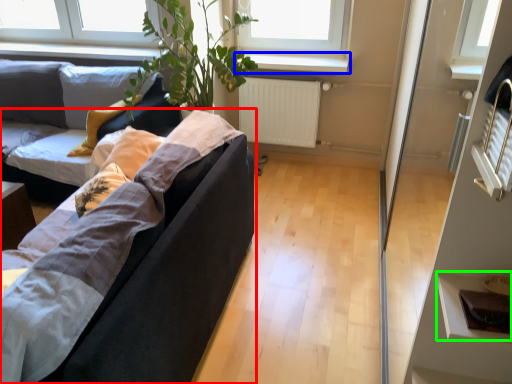
Question: Which object is positioned farthest from studio couch (highlighted by a red box)? Select from window sill (highlighted by a blue box) and shelf (highlighted by a green box).

Choices:
 (A) window sill
 (B) shelf

Answer: (A)